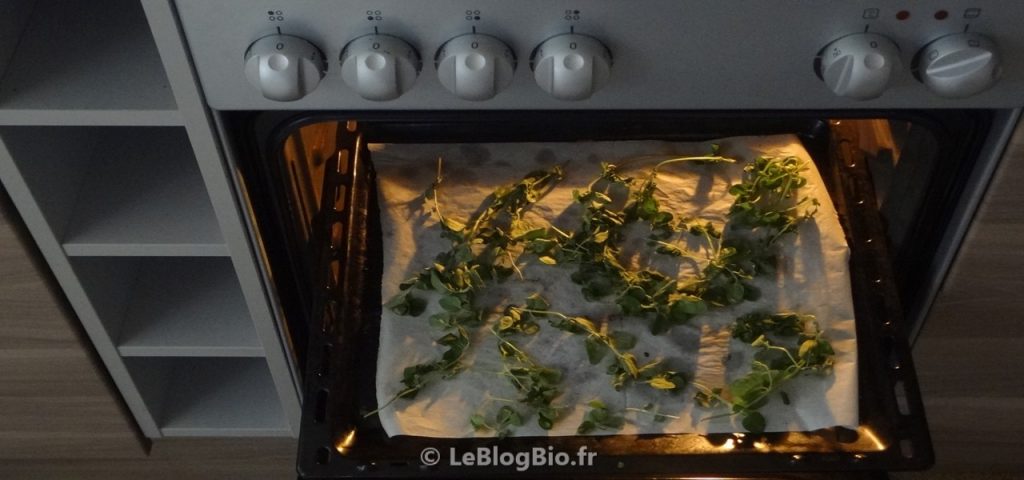
At what (x,y) coordinates should I click in order to perform the action: click on baking sheet. Please return your answer as a coordinate pair (x, y). Looking at the image, I should click on (527, 132).